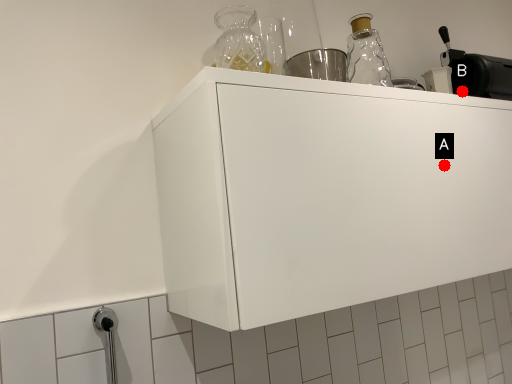
Question: Two points are circled on the image, labeled by A and B beside each circle. Which point is closer to the camera taking this photo?

Choices:
 (A) A is closer
 (B) B is closer

Answer: (A)